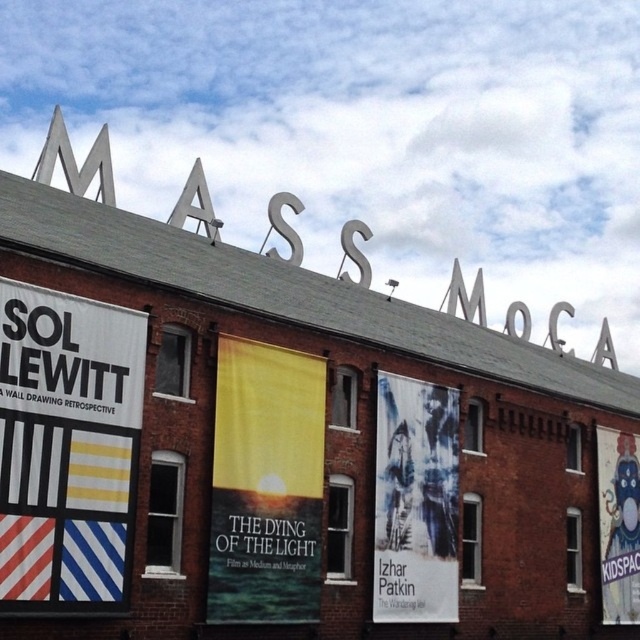
You are standing in front of the building and want to read the text on the blue fabric poster at center. Can you read it clearly from your current position?

The blue fabric poster at center is 39.44 meters from viewer, so you cannot read it clearly from your current position.

You are standing in front of the MASS MOCA building and want to locate the white paper banner at left. According to the coordinates provided, where exactly should you look to find it?

The white paper banner at left is located at coordinates point (67, 448), so you should look to the upper left area of the building since the x coordinate 0.700 indicates the left side and y coordinate 0.105 indicates the upper part.

You are an event planner trying to hang two fabric posters for an upcoming exhibition. The blue fabric poster at center and the cartoonish fabric poster at right are to be displayed on a wall that can only accommodate items up to the height of the taller poster. Which poster should you choose to ensure it fits without modification?

The cartoonish fabric poster at right is taller than the blue fabric poster at center, so you should choose the cartoonish fabric poster at right to ensure it fits within the wall height limit.